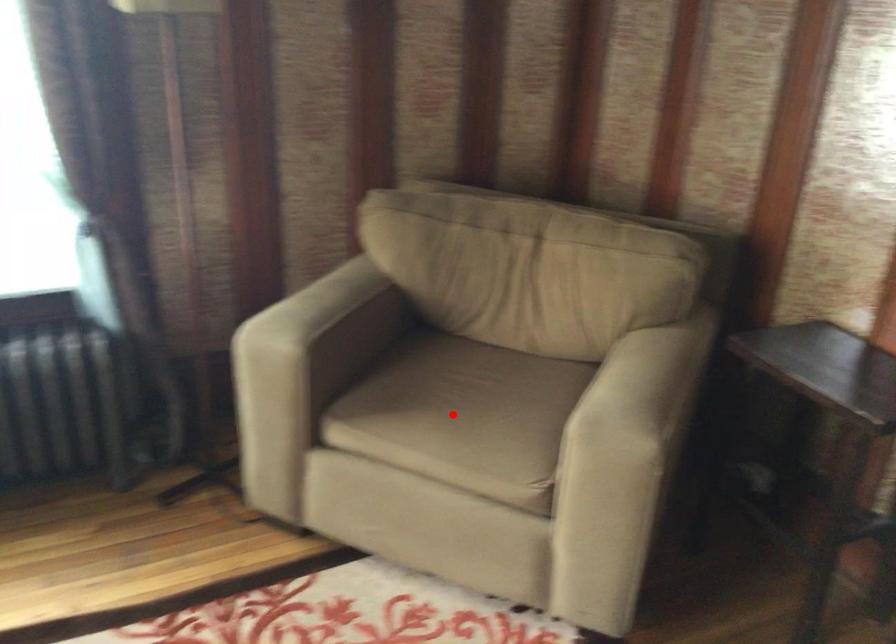
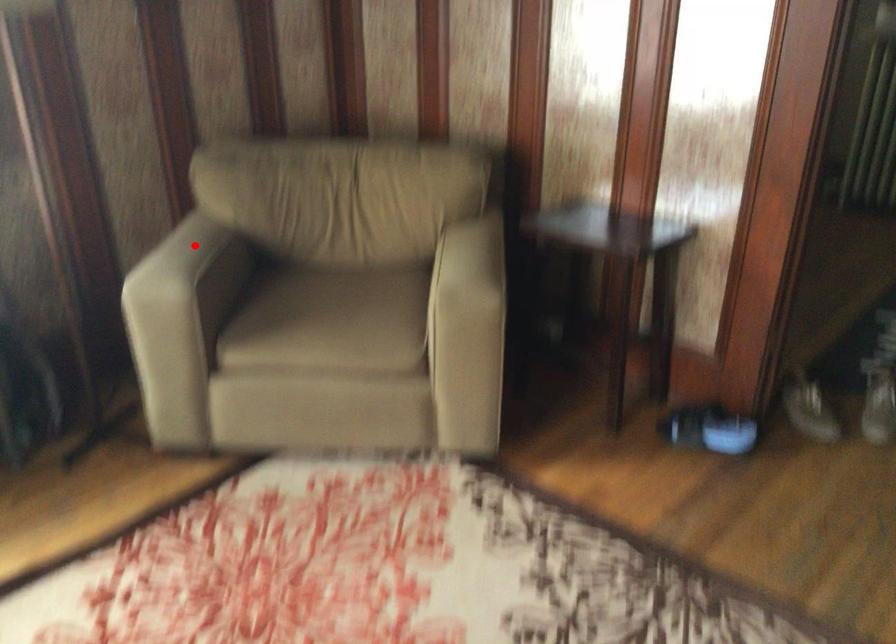
I am providing you with two images of the same scene from different viewpoints. A red point is marked on the first image and another point is marked on the second image. Are the points marked in image1 and image2 representing the same 3D position?

No